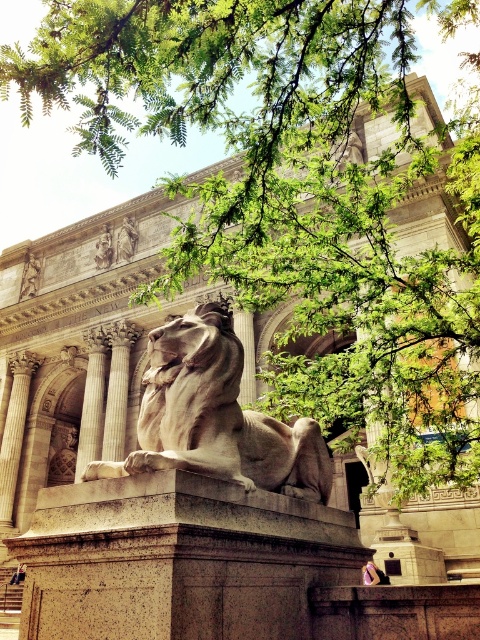
Is point (120, 451) positioned after point (253, 362)?

Yes, point (120, 451) is behind point (253, 362).

Is point (117, 433) behind point (247, 348)?

Yes, it is behind point (247, 348).

This screenshot has width=480, height=640. In order to click on beige stone column at left in this screenshot , I will do `click(116, 404)`.

Does white stone lion at center have a greater width compared to beige stone column at left?

Correct, the width of white stone lion at center exceeds that of beige stone column at left.

In order to click on white stone lion at center in this screenshot , I will do `click(216, 417)`.

Identify the location of white stone lion at center. (216, 417).

Between point (99, 451) and point (119, 380), which one is positioned in front?

Point (99, 451) is more forward.

Between white marble column at center and beige stone column at left, which one is positioned higher?

Positioned higher is beige stone column at left.

Describe the element at coordinates (92, 403) in the screenshot. I see `white marble column at center` at that location.

Where is `white marble column at center`? This screenshot has width=480, height=640. white marble column at center is located at coordinates (92, 403).